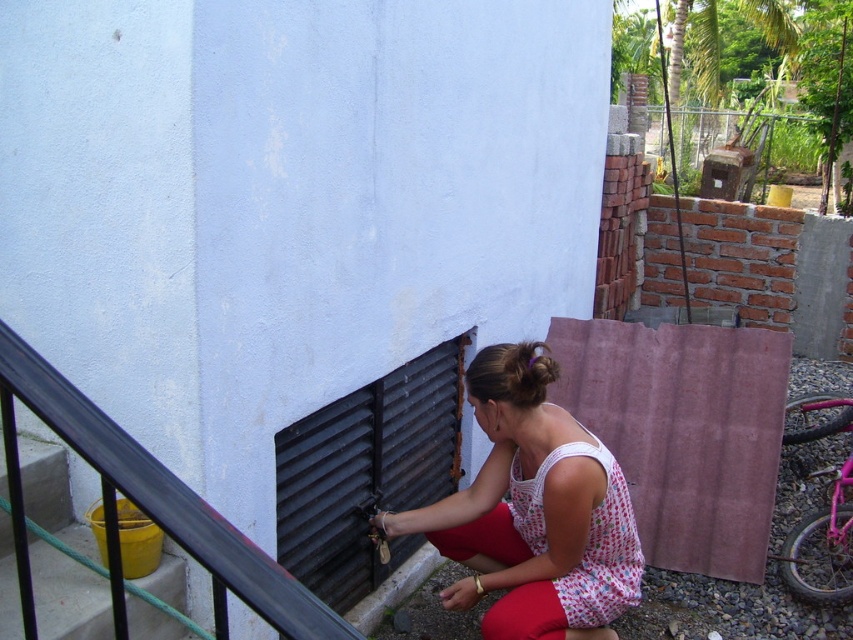
Can you confirm if metallic gray stair at lower left is positioned above white dotted fabric dress at lower center?

Correct, metallic gray stair at lower left is located above white dotted fabric dress at lower center.

Which is in front, point (44, 556) or point (605, 538)?

Point (44, 556) is in front.

Is point (94, 586) positioned behind point (512, 516)?

No, it is not.

The width and height of the screenshot is (853, 640). I want to click on metallic gray stair at lower left, so click(67, 595).

Who is more distant from viewer, (152, 508) or (45, 589)?

The point (45, 589) is more distant.

Who is more forward, (x=114, y=605) or (x=154, y=625)?

Point (x=114, y=605) is in front.

Locate an element on the screen. Image resolution: width=853 pixels, height=640 pixels. black metal/rail at lower left is located at coordinates (148, 508).

Is white dotted dress at center above black metal/rail at lower left?

No, white dotted dress at center is not above black metal/rail at lower left.

Can you confirm if white dotted dress at center is positioned to the left of black metal/rail at lower left?

In fact, white dotted dress at center is to the right of black metal/rail at lower left.

Is point (495, 397) farther from viewer compared to point (7, 410)?

That is True.

Find the location of a particular element. white dotted dress at center is located at coordinates coord(532,512).